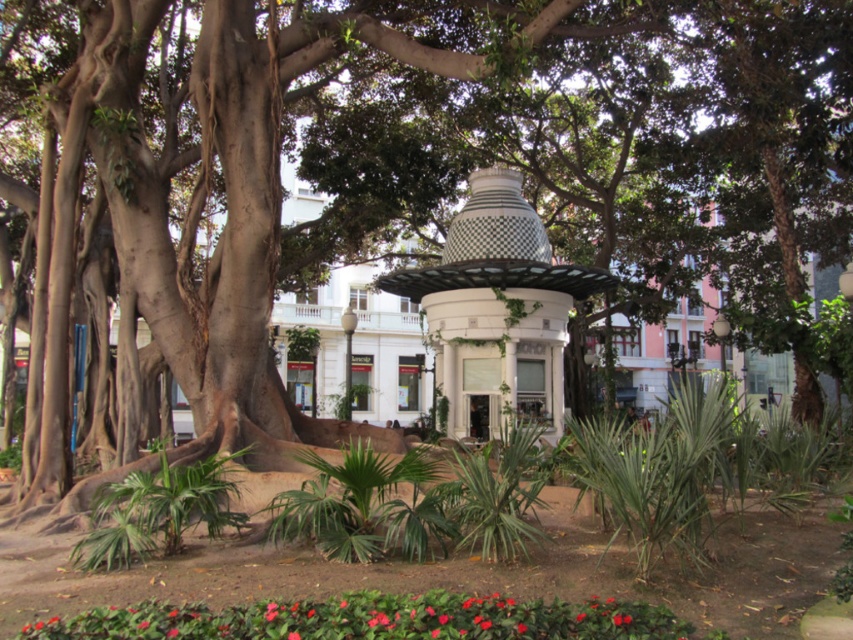
Question: Which point is closer to the camera taking this photo?

Choices:
 (A) (553, 609)
 (B) (505, 198)

Answer: (A)

Question: Among these objects, which one is farthest from the camera?

Choices:
 (A) white mosaic gazebo at center
 (B) smooth glossy red flower at lower center

Answer: (A)

Question: Observing the image, what is the correct spatial positioning of white mosaic gazebo at center in reference to smooth glossy red flower at lower center?

Choices:
 (A) below
 (B) above

Answer: (B)

Question: Can you confirm if white mosaic gazebo at center is positioned above smooth glossy red flower at lower center?

Choices:
 (A) no
 (B) yes

Answer: (B)

Question: Can you confirm if white mosaic gazebo at center is bigger than smooth glossy red flower at lower center?

Choices:
 (A) no
 (B) yes

Answer: (A)